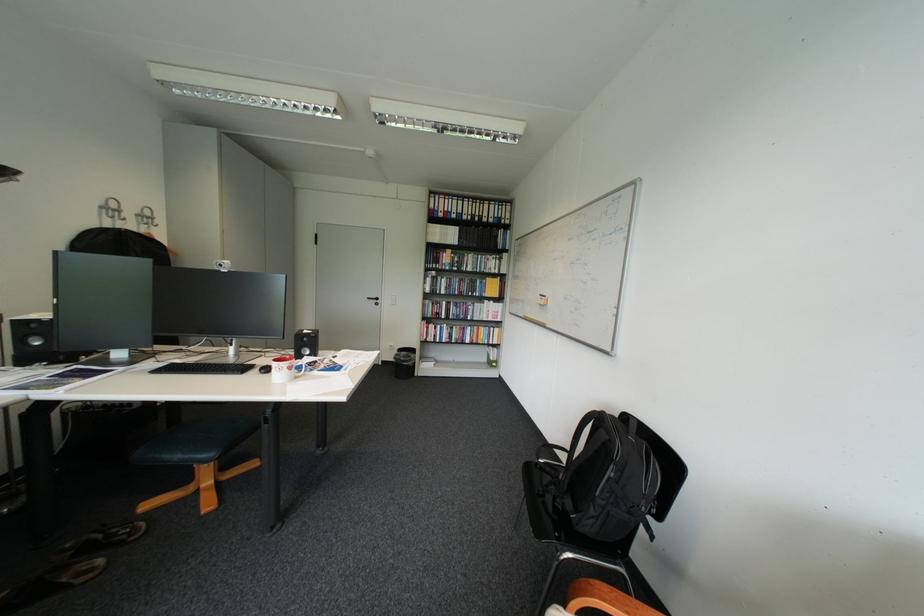
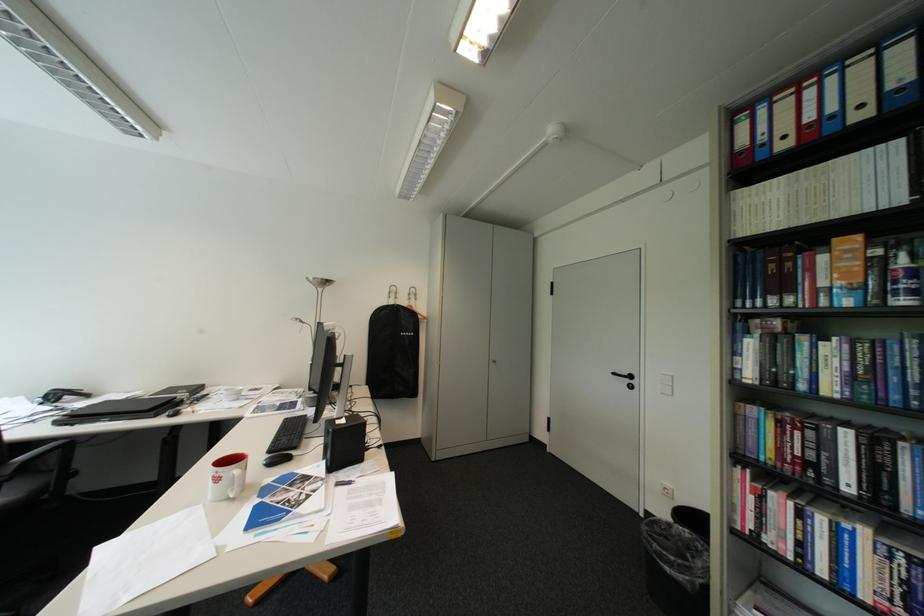
Where in the second image is the point corresponding to point 457,209 from the first image?

(821, 119)